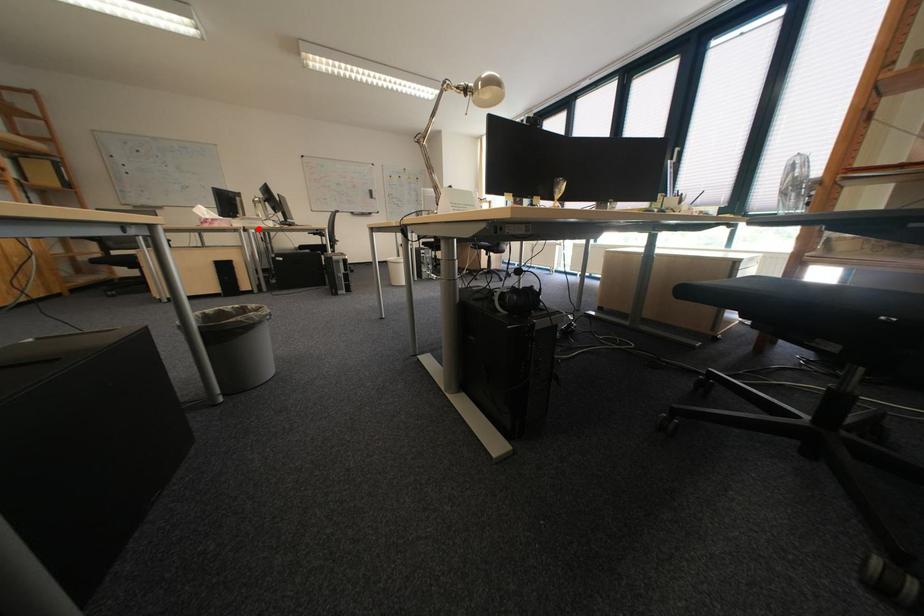
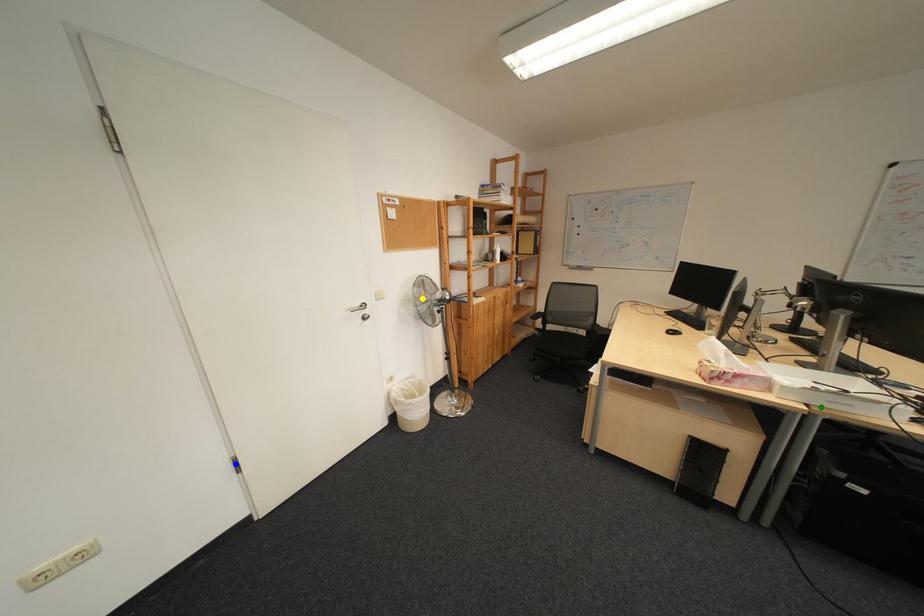
Question: I am providing you with two images of the same scene from different viewpoints. A red point is marked on the first image. You are given multiple points on the second image. Which point in image 2 represents the same 3d spot as the red point in image 1?

Choices:
 (A) yellow point
 (B) blue point
 (C) green point

Answer: (C)